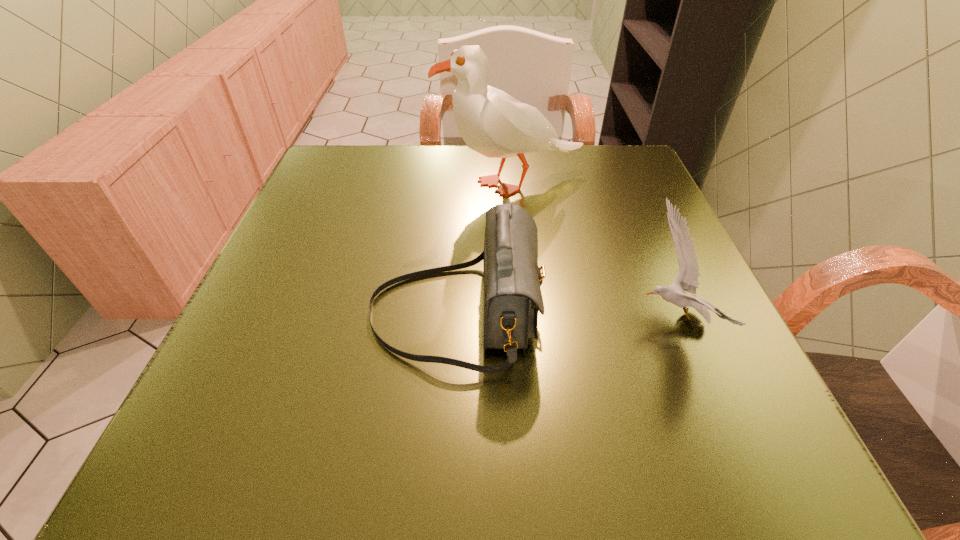
Locate an element on the screen. The height and width of the screenshot is (540, 960). free space between the taller gull and the shoulder bag is located at coordinates (484, 248).

Where is `object that is the closest to the shoulder bag`? Image resolution: width=960 pixels, height=540 pixels. object that is the closest to the shoulder bag is located at coordinates pos(687,279).

Image resolution: width=960 pixels, height=540 pixels. Identify the location of object that is the second nearest to the rightmost object. point(491,122).

Identify the location of free location that satisfies the following two spatial constraints: 1. at the beak of the left gull; 2. on the front side of the second shortest object. The height and width of the screenshot is (540, 960). (525, 312).